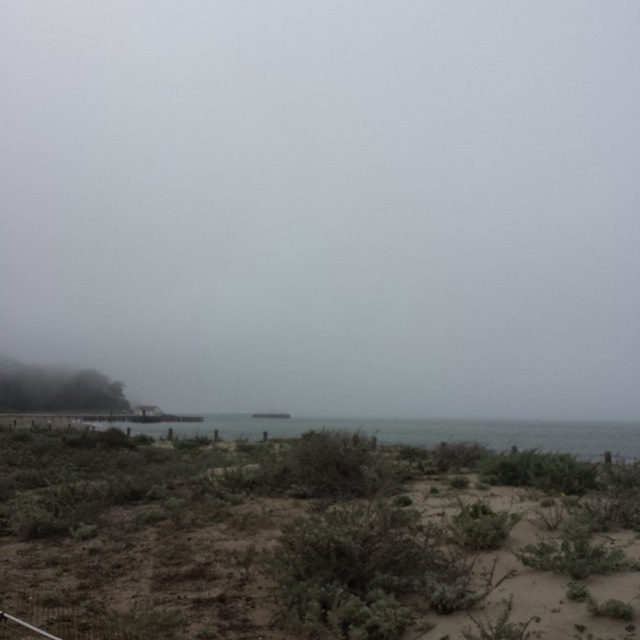
You are a landscape photographer planning to capture the foggy coastal scene. You want to ensure that both the foggy misty sky at upper center and the brown sandy soil at lower center are clearly visible in your shot. Based on their positions, which object should you focus on first to ensure both are in frame?

The foggy misty sky at upper center is taller than the brown sandy soil at lower center, so you should focus on the foggy misty sky at upper center first to ensure both are in frame.

You are a photographer trying to capture the clear water at center and the foggy misty sky at upper center in one shot. Since you want both elements to be in focus, which one should you focus on to ensure the other is also sharp?

You should focus on the foggy misty sky at upper center because it is closer to the viewer than the clear water at center. By focusing on the closer object, the farther object will still be within the depth of field and appear sharp.

You are a hiker planning to cross from the brown sandy soil at lower center to the clear water at center. Based on their widths, which area would you prefer to walk on and why?

The brown sandy soil at lower center has a narrower width compared to the clear water at center. Since the sandy soil is narrower, it might be easier to cross quickly, but the wider clear water area could offer a more stable path depending on the depth and firmness of the sand.